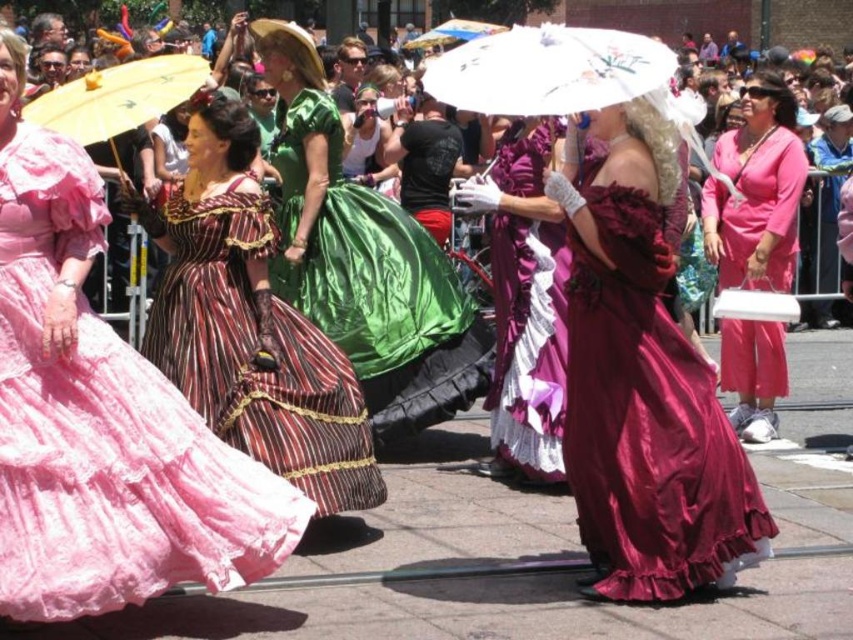
You are a photographer at the event and want to capture a photo of the shiny burgundy dress at center and the yellow paper parasol at upper left. Which object is wider in the image?

The shiny burgundy dress at center is wider than the yellow paper parasol at upper left.

You are standing in the crowd watching the historical reenactment. You notice two points in the scene, one at point coordinates point (399,330) and another at point coordinates point (564,74). Which point is closer to you?

Point (399,330) is closer to you because it is further to the viewer than point (564,74).

You are a photographer at the event and want to capture a photo that includes both the green satin dress at center and the white paper umbrella at upper center. Which object should you focus on first if you want to ensure both are in frame without moving the camera?

You should focus on the green satin dress at center first because it is shorter than the white paper umbrella at upper center, so adjusting the camera angle to include the taller umbrella might require a wider shot that still captures the dress.